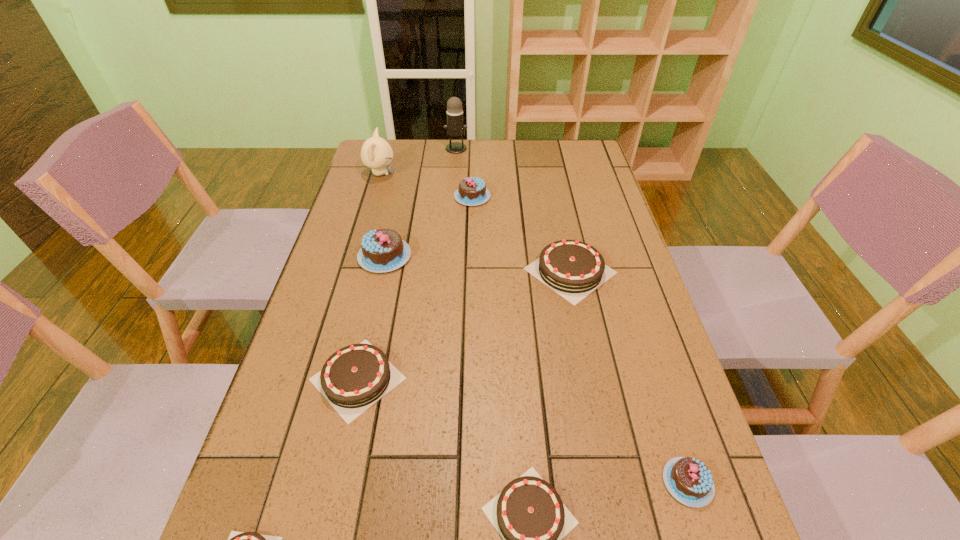
Image resolution: width=960 pixels, height=540 pixels. I want to click on free spot between the nearest pink chocolate cake and the second smallest pink chocolate cake, so click(x=580, y=340).

I want to click on blank region between the fourth nearest chocolate cake and the third tallest object, so click(372, 318).

You are a GUI agent. You are given a task and a screenshot of the screen. Output one action in this format:
    pyautogui.click(x=<x>, y=<y>)
    Task: Click on the free spot between the nearest pink chocolate cake and the fourth nearest object
    The width and height of the screenshot is (960, 540).
    Given the screenshot: What is the action you would take?
    pyautogui.click(x=522, y=430)

Where is `free area in between the gray microphone and the farthest chocolate cake`? This screenshot has width=960, height=540. free area in between the gray microphone and the farthest chocolate cake is located at coordinates (465, 173).

You are a GUI agent. You are given a task and a screenshot of the screen. Output one action in this format:
    pyautogui.click(x=<x>, y=<y>)
    Task: Click on the object that stands as the closest to the nearest pink chocolate cake
    
    Given the screenshot: What is the action you would take?
    pyautogui.click(x=529, y=514)

Locate an element on the screen. object that can be found as the closest to the fourth farthest chocolate cake is located at coordinates pos(529,514).

Locate an element on the screen. chocolate cake that is the fourth closest to the second smallest pink chocolate cake is located at coordinates (529, 514).

The width and height of the screenshot is (960, 540). I want to click on chocolate cake that is the fifth nearest to the biggest pink chocolate cake, so click(236, 539).

Locate which pink chocolate cake is the second closest to the second pink chocolate cake from right to left. Please provide its 2D coordinates. Your answer should be formatted as a tuple, i.e. [(x, y)], where the tuple contains the x and y coordinates of a point satisfying the conditions above.

[(689, 481)]

Where is `the second closest pink chocolate cake relative to the second pink chocolate cake from right to left`? The image size is (960, 540). the second closest pink chocolate cake relative to the second pink chocolate cake from right to left is located at coordinates (689, 481).